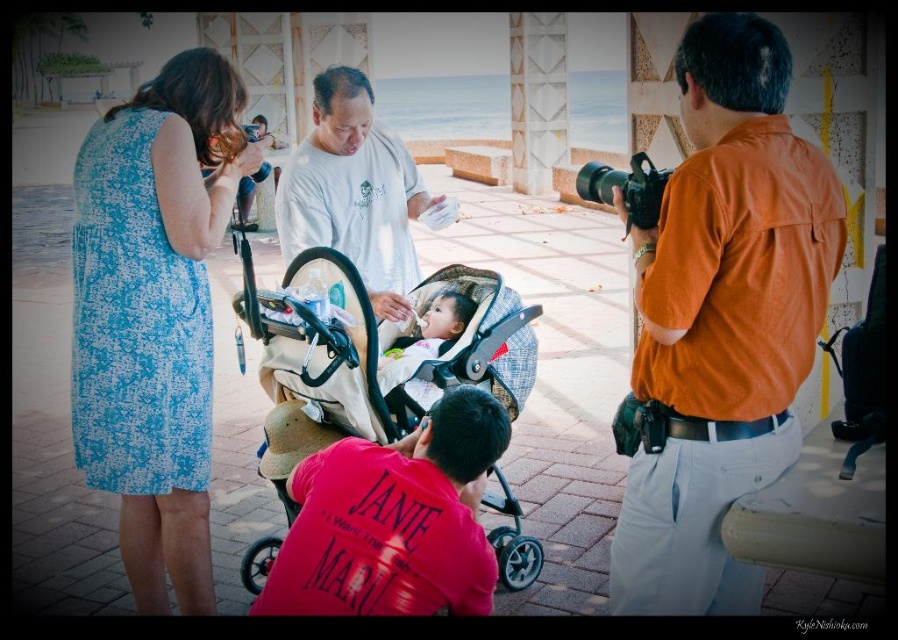
Is orange cotton shirt at right taller than black plastic camera at right?

Indeed, orange cotton shirt at right has a greater height compared to black plastic camera at right.

Between orange cotton shirt at right and black plastic camera at right, which one appears on the left side from the viewer's perspective?

black plastic camera at right

In order to click on orange cotton shirt at right in this screenshot , I will do `click(722, 321)`.

This screenshot has height=640, width=898. Identify the location of orange cotton shirt at right. 722,321.

Does point (177, 124) come behind point (394, 353)?

No, (177, 124) is closer to viewer.

Is blue printed dress at left wider than soft white baby at center?

No, blue printed dress at left is not wider than soft white baby at center.

Who is more forward, (207, 76) or (436, 305)?

Point (436, 305) is more forward.

Identify the location of blue printed dress at left. (154, 314).

Can you confirm if blue printed dress at left is smaller than black plastic camera at right?

Yes, blue printed dress at left is smaller than black plastic camera at right.

Does blue printed dress at left have a greater height compared to black plastic camera at right?

No.

You are a GUI agent. You are given a task and a screenshot of the screen. Output one action in this format:
    pyautogui.click(x=<x>, y=<y>)
    Task: Click on the blue printed dress at left
    Image resolution: width=898 pixels, height=640 pixels.
    Given the screenshot: What is the action you would take?
    pyautogui.click(x=154, y=314)

Where is `blue printed dress at left`? This screenshot has height=640, width=898. blue printed dress at left is located at coordinates (154, 314).